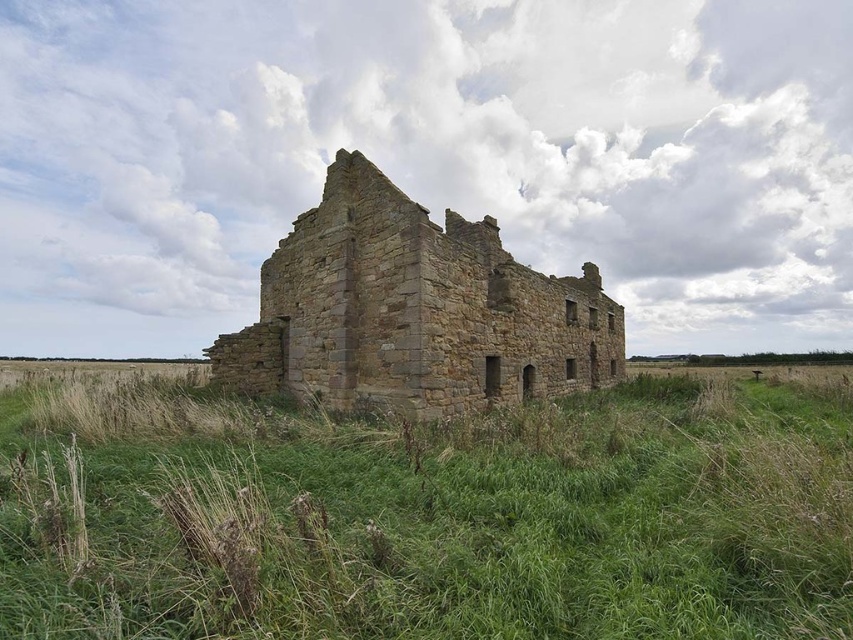
Question: Does green grass at center have a larger size compared to brown stone castle at center?

Choices:
 (A) no
 (B) yes

Answer: (A)

Question: Which object is closer to the camera taking this photo?

Choices:
 (A) brown stone castle at center
 (B) green grass at center

Answer: (B)

Question: Can you confirm if green grass at center is smaller than brown stone castle at center?

Choices:
 (A) no
 (B) yes

Answer: (B)

Question: Is green grass at center closer to the viewer compared to brown stone castle at center?

Choices:
 (A) no
 (B) yes

Answer: (B)